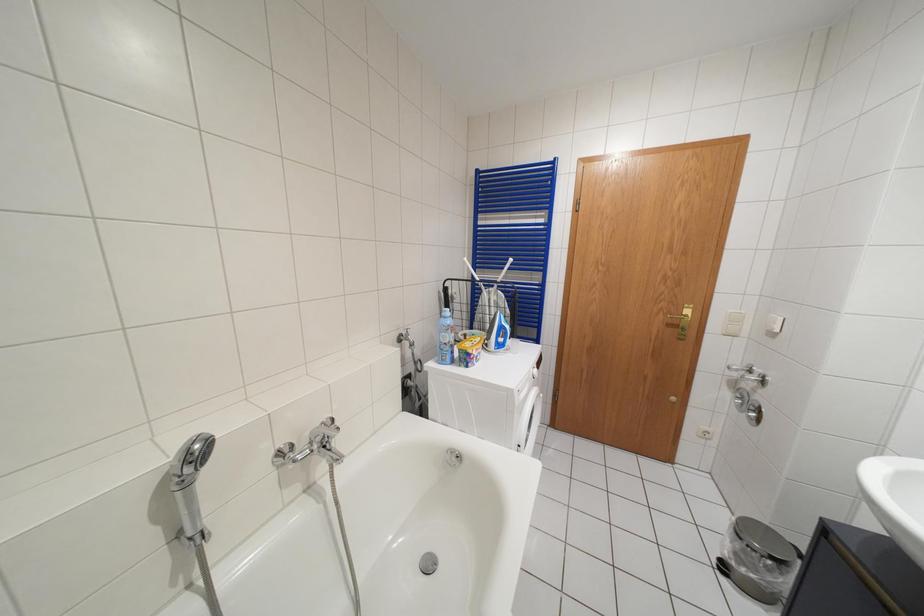
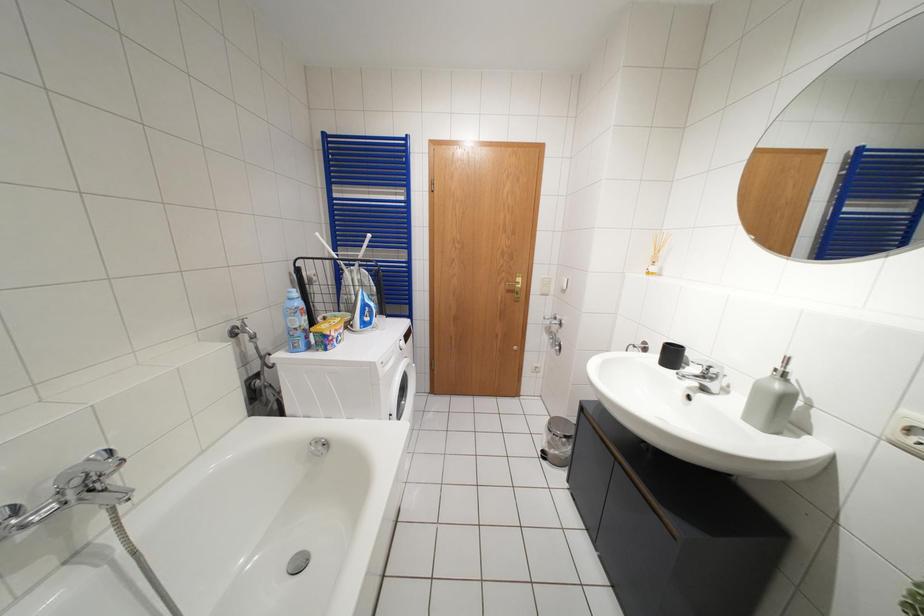
Question: The camera is either moving clockwise (left) or counter-clockwise (right) around the object. The first image is from the beginning of the video and the second image is from the end. Is the camera moving left or right when shooting the video?

Choices:
 (A) Left
 (B) Right

Answer: (A)